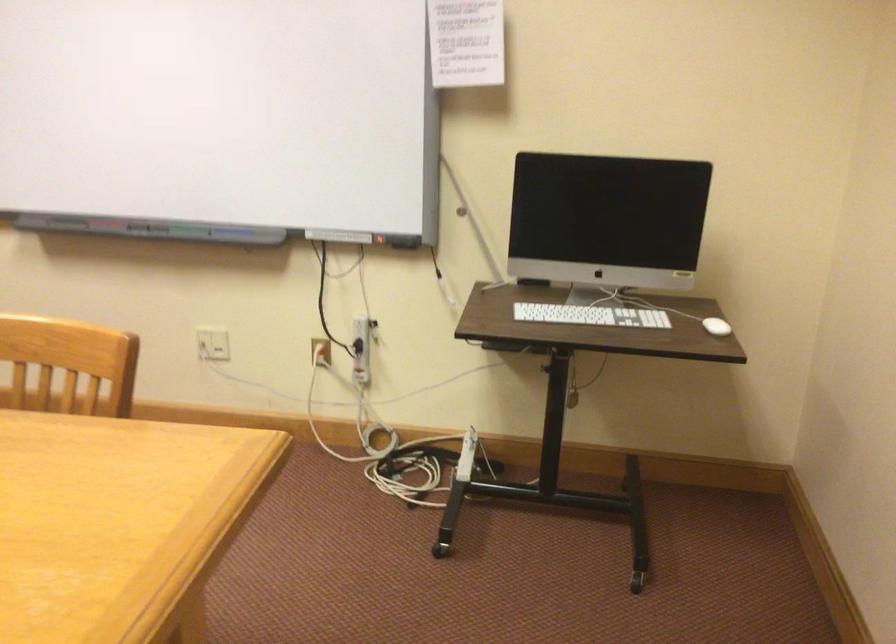
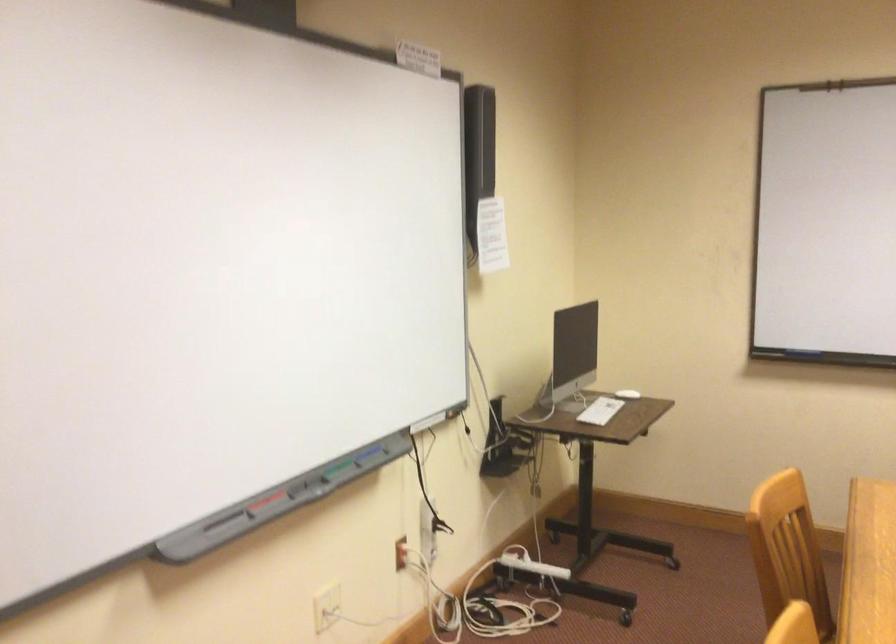
Locate, in the second image, the point that corresponds to pixel 243 234 in the first image.

(368, 453)